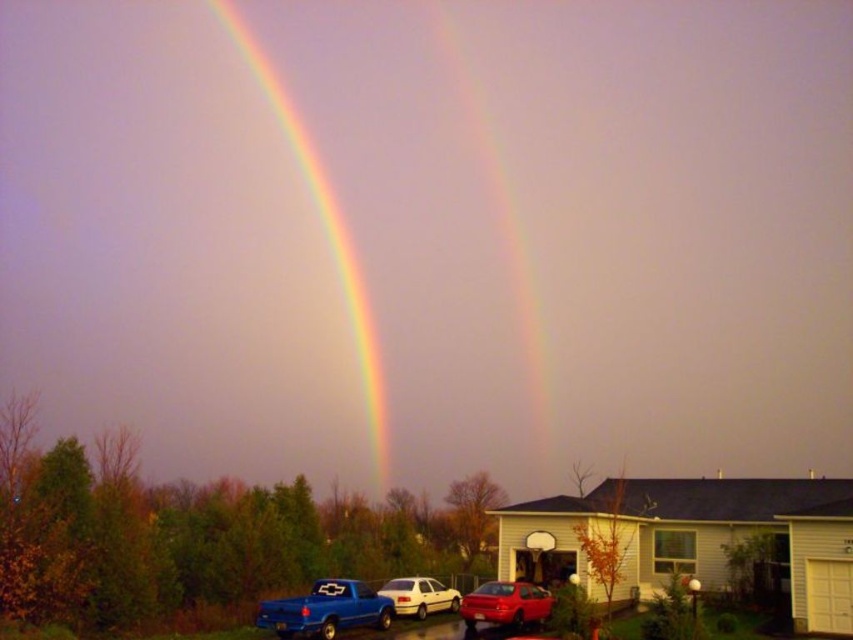
Does metallic blue truck at lower left have a greater width compared to white matte sedan at center?

Yes.

Which is below, metallic blue truck at lower left or white matte sedan at center?

metallic blue truck at lower left is lower down.

At what (x,y) coordinates should I click in order to perform the action: click on metallic blue truck at lower left. Please return your answer as a coordinate pair (x, y). This screenshot has height=640, width=853. Looking at the image, I should click on (387, 540).

Is rainbow at upper left shorter than matte blue truck at lower left?

No, rainbow at upper left is not shorter than matte blue truck at lower left.

The image size is (853, 640). Find the location of `rainbow at upper left`. rainbow at upper left is located at coordinates (323, 232).

Find the location of `rainbow at upper left`. rainbow at upper left is located at coordinates click(323, 232).

Between shiny red sedan at center and white matte sedan at center, which one has more height?

Standing taller between the two is white matte sedan at center.

Who is shorter, shiny red sedan at center or white matte sedan at center?

Standing shorter between the two is shiny red sedan at center.

Between point (479, 605) and point (405, 604), which one is positioned in front?

Point (479, 605) is in front.

Where is `shiny red sedan at center`? The height and width of the screenshot is (640, 853). shiny red sedan at center is located at coordinates (505, 604).